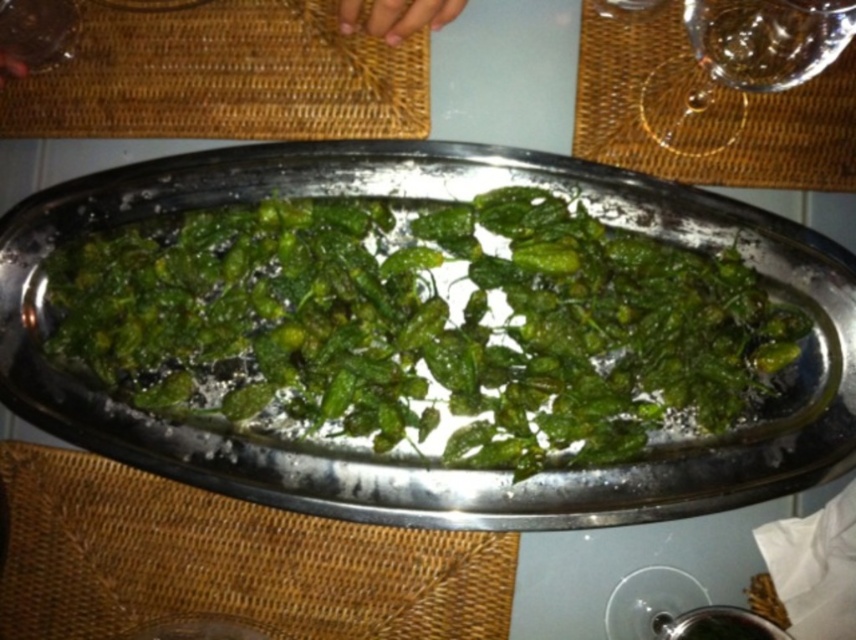
Is green leafy vegetable at center shorter than transparent glass at upper right?

No.

Is point (476, 284) positioned after point (749, 68)?

Yes.

Which is behind, point (687, 349) or point (702, 52)?

Positioned behind is point (702, 52).

The height and width of the screenshot is (640, 856). Find the location of `green leafy vegetable at center`. green leafy vegetable at center is located at coordinates (423, 326).